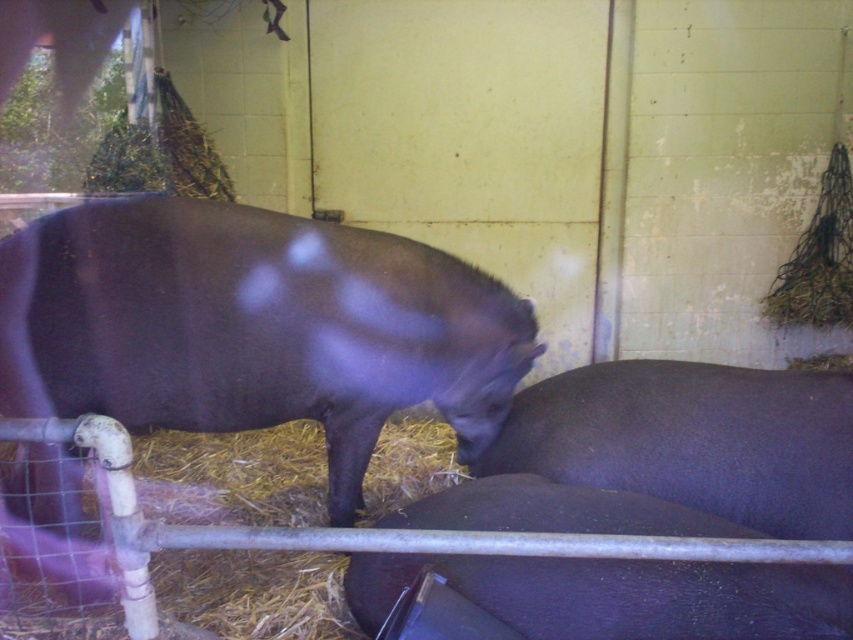
Which is below, shiny dark brown pig at center or shiny black pig at lower center?

shiny black pig at lower center is below.

Is shiny dark brown pig at center taller than shiny black pig at lower center?

Correct, shiny dark brown pig at center is much taller as shiny black pig at lower center.

What do you see at coordinates (253, 326) in the screenshot? The width and height of the screenshot is (853, 640). I see `shiny dark brown pig at center` at bounding box center [253, 326].

Locate an element on the screen. The width and height of the screenshot is (853, 640). shiny dark brown pig at center is located at coordinates (253, 326).